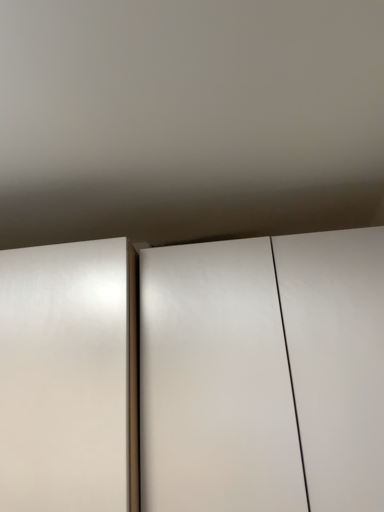
Measure the distance between satin white door at left and camera.

They are 32.64 inches apart.

What are the coordinates of `satin white door at left` in the screenshot? It's located at click(x=65, y=376).

The width and height of the screenshot is (384, 512). Describe the element at coordinates (65, 376) in the screenshot. I see `satin white door at left` at that location.

This screenshot has height=512, width=384. Describe the element at coordinates (194, 375) in the screenshot. I see `white glossy cupboard at center` at that location.

At what (x,y) coordinates should I click in order to perform the action: click on white glossy cupboard at center. Please return your answer as a coordinate pair (x, y). This screenshot has width=384, height=512. Looking at the image, I should click on (194, 375).

The height and width of the screenshot is (512, 384). Identify the location of satin white door at left. (65, 376).

Considering the relative positions of satin white door at left and white glossy cupboard at center in the image provided, is satin white door at left to the right of white glossy cupboard at center from the viewer's perspective?

Incorrect, satin white door at left is not on the right side of white glossy cupboard at center.

Which object is closer to the camera taking this photo, satin white door at left or white glossy cupboard at center?

Positioned in front is satin white door at left.

Considering the positions of point (127, 490) and point (147, 286), is point (127, 490) closer or farther from the camera than point (147, 286)?

Clearly, point (127, 490) is closer to the camera than point (147, 286).

From the image's perspective, which one is positioned lower, satin white door at left or white glossy cupboard at center?

From the image's view, satin white door at left is below.

From a real-world perspective, is satin white door at left below white glossy cupboard at center?

No, from a real-world perspective, satin white door at left is not below white glossy cupboard at center.

Considering the sizes of satin white door at left and white glossy cupboard at center in the image, is satin white door at left wider or thinner than white glossy cupboard at center?

In the image, satin white door at left appears to be more narrow than white glossy cupboard at center.

Consider the image. Is satin white door at left taller than white glossy cupboard at center?

In fact, satin white door at left may be shorter than white glossy cupboard at center.

Considering the sizes of objects satin white door at left and white glossy cupboard at center in the image provided, who is smaller, satin white door at left or white glossy cupboard at center?

Smaller between the two is satin white door at left.

Is satin white door at left positioned beyond the bounds of white glossy cupboard at center?

Indeed, satin white door at left is completely outside white glossy cupboard at center.

Looking at this image, is there a large distance between satin white door at left and white glossy cupboard at center?

No, satin white door at left is not far away from white glossy cupboard at center.

Could you tell me if satin white door at left is facing white glossy cupboard at center?

No, satin white door at left is not aimed at white glossy cupboard at center.

What's the angular difference between satin white door at left and white glossy cupboard at center's facing directions?

There is a 0.000997-degree angle between the facing directions of satin white door at left and white glossy cupboard at center.

The image size is (384, 512). What are the coordinates of `cupboard behind the satin white door at left` in the screenshot? It's located at (194, 375).

Considering the relative positions of white glossy cupboard at center and satin white door at left in the image provided, is white glossy cupboard at center to the left of satin white door at left from the viewer's perspective?

No.

Is white glossy cupboard at center further to camera compared to satin white door at left?

Yes, the depth of white glossy cupboard at center is greater than that of satin white door at left.

Considering the positions of points (226, 297) and (55, 482), is point (226, 297) farther from camera compared to point (55, 482)?

Yes, point (226, 297) is farther from viewer.

In the scene shown: From the image's perspective, would you say white glossy cupboard at center is shown under satin white door at left?

No, from the image's perspective, white glossy cupboard at center is not below satin white door at left.

From a real-world perspective, is white glossy cupboard at center located higher than satin white door at left?

No.

Considering the sizes of objects white glossy cupboard at center and satin white door at left in the image provided, who is thinner, white glossy cupboard at center or satin white door at left?

satin white door at left is thinner.

Between white glossy cupboard at center and satin white door at left, which one has less height?

Standing shorter between the two is satin white door at left.

Who is bigger, white glossy cupboard at center or satin white door at left?

Bigger between the two is white glossy cupboard at center.

Is white glossy cupboard at center situated inside satin white door at left or outside?

white glossy cupboard at center lies outside satin white door at left.

Does white glossy cupboard at center touch satin white door at left?

There is a gap between white glossy cupboard at center and satin white door at left.

Is white glossy cupboard at center oriented towards satin white door at left?

No, white glossy cupboard at center is not turned towards satin white door at left.

How far apart are white glossy cupboard at center and satin white door at left?

4.43 inches.

Image resolution: width=384 pixels, height=512 pixels. Identify the location of door below the white glossy cupboard at center (from the image's perspective). (65, 376).

Locate an element on the screen. The image size is (384, 512). door lying on the left of white glossy cupboard at center is located at coordinates (65, 376).

The width and height of the screenshot is (384, 512). I want to click on cupboard located behind the satin white door at left, so click(x=194, y=375).